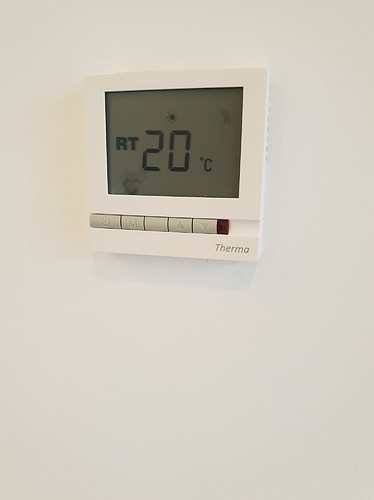
Where is `temperature down button`? The image size is (374, 500). temperature down button is located at coordinates (203, 222).